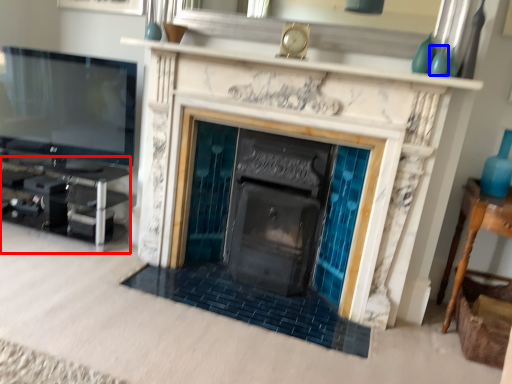
Question: Which object is closer to the camera taking this photo, entertainment center (highlighted by a red box) or turquoise (highlighted by a blue box)?

Choices:
 (A) entertainment center
 (B) turquoise

Answer: (B)